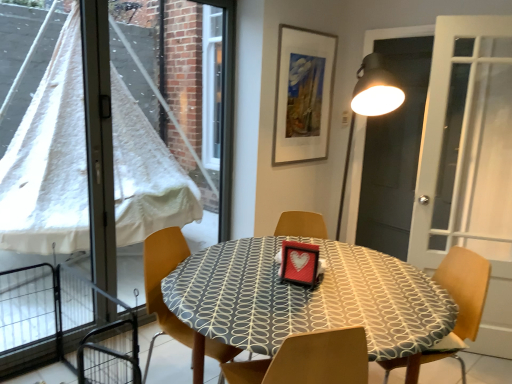
This screenshot has height=384, width=512. Describe the element at coordinates (303, 95) in the screenshot. I see `matte wooden picture frame at upper center` at that location.

The height and width of the screenshot is (384, 512). Identify the location of transparent plastic window at left. (49, 158).

Measure the distance between point (399, 53) and camera.

Point (399, 53) and camera are 8.89 feet apart from each other.

Describe the element at coordinates (66, 325) in the screenshot. I see `black metal gate at lower left` at that location.

Where is `matte wooden picture frame at upper center`? matte wooden picture frame at upper center is located at coordinates (303, 95).

Considering the relative sizes of matte wooden picture frame at upper center and patterned fabric table at center in the image provided, is matte wooden picture frame at upper center thinner than patterned fabric table at center?

Yes.

Measure the distance between matte wooden picture frame at upper center and patterned fabric table at center.

matte wooden picture frame at upper center and patterned fabric table at center are 1.22 meters apart.

Does matte wooden picture frame at upper center have a greater height compared to patterned fabric table at center?

Yes.

Is matte wooden picture frame at upper center with patterned fabric table at center?

No, matte wooden picture frame at upper center is not in contact with patterned fabric table at center.

In terms of width, does patterned fabric table at center look wider or thinner when compared to black matte screen door at upper right?

In the image, patterned fabric table at center appears to be wider than black matte screen door at upper right.

Which object is more forward, patterned fabric table at center or black matte screen door at upper right?

patterned fabric table at center is closer to the camera.

Does point (167, 316) come in front of point (397, 159)?

That is True.

Could you tell me if patterned fabric table at center is turned towards black matte screen door at upper right?

No.

Could wooden chair at right, arranged as the 2th chair when viewed from the left, be considered to be inside black metal gate at lower left?

Definitely not — wooden chair at right, arranged as the 2th chair when viewed from the left, is not inside black metal gate at lower left.

From a real-world perspective, between black metal gate at lower left and wooden chair at right, arranged as the 2th chair when viewed from the left, who is vertically lower?

black metal gate at lower left.

In the image, is black metal gate at lower left positioned in front of or behind wooden chair at right, positioned as the first chair in right-to-left order?

Visually, black metal gate at lower left is located in front of wooden chair at right, positioned as the first chair in right-to-left order.

This screenshot has width=512, height=384. Find the location of `chair that is the 2nd one when counting rightward from the black metal gate at lower left`. chair that is the 2nd one when counting rightward from the black metal gate at lower left is located at coordinates (461, 301).

Is matte wooden picture frame at upper center situated inside black matte screen door at upper right or outside?

matte wooden picture frame at upper center is outside black matte screen door at upper right.

Is matte wooden picture frame at upper center bigger than black matte screen door at upper right?

Correct, matte wooden picture frame at upper center is larger in size than black matte screen door at upper right.

Measure the distance from matte wooden picture frame at upper center to black matte screen door at upper right.

A distance of 23.12 inches exists between matte wooden picture frame at upper center and black matte screen door at upper right.

Between point (282, 106) and point (407, 167), which one is positioned behind?

The point (407, 167) is farther.

Does matte wooden picture frame at upper center touch transparent plastic window at left?

No, matte wooden picture frame at upper center is not next to transparent plastic window at left.

Looking at this image, which is closer, [311,60] or [58,60]?

Clearly, point [311,60] is closer to the camera than point [58,60].

Is matte wooden picture frame at upper center not within transparent plastic window at left?

Absolutely, matte wooden picture frame at upper center is external to transparent plastic window at left.

Is transparent plastic window at left taller than wooden chair at right, arranged as the 2th chair when viewed from the left?

Indeed, transparent plastic window at left has a greater height compared to wooden chair at right, arranged as the 2th chair when viewed from the left.

Is point (78, 368) closer to viewer compared to point (464, 277)?

No, it is not.

Locate an element on the screen. The width and height of the screenshot is (512, 384). window above the wooden chair at right, positioned as the first chair in right-to-left order (from the image's perspective) is located at coordinates (49, 158).

Is transparent plastic window at left located outside wooden chair at right, positioned as the first chair in right-to-left order?

Yes.

From a real-world perspective, is transparent plastic window at left positioned above or below wooden chair at center, arranged as the 1th chair when viewed from the left?

transparent plastic window at left is situated higher than wooden chair at center, arranged as the 1th chair when viewed from the left, in the real world.

Which object is more forward, transparent plastic window at left or wooden chair at center, placed as the second chair when sorted from right to left?

wooden chair at center, placed as the second chair when sorted from right to left, is in front.

Considering the points (196, 218) and (175, 249), which point is in front, point (196, 218) or point (175, 249)?

Positioned in front is point (175, 249).

This screenshot has width=512, height=384. Find the location of `table below the matte wooden picture frame at upper center (from the image's perspective)`. table below the matte wooden picture frame at upper center (from the image's perspective) is located at coordinates (162, 278).

The height and width of the screenshot is (384, 512). In the image, there is a patterned fabric table at center. What are the coordinates of `screen door above it (from the image's perspective)` in the screenshot? It's located at tap(394, 150).

Estimate the real-world distances between objects in this image. Which object is closer to matte wooden picture frame at upper center, wooden chair at center, arranged as the 1th chair when viewed from the left, or black metal gate at lower left?

wooden chair at center, arranged as the 1th chair when viewed from the left, is closer to matte wooden picture frame at upper center.

Based on their spatial positions, is wooden chair at center, placed as the second chair when sorted from right to left, or black metal gate at lower left closer to wooden chair at right, arranged as the 2th chair when viewed from the left?

Among the two, wooden chair at center, placed as the second chair when sorted from right to left, is located nearer to wooden chair at right, arranged as the 2th chair when viewed from the left.

Based on their spatial positions, is wooden chair at center, placed as the second chair when sorted from right to left, or wooden chair at right, arranged as the 2th chair when viewed from the left, further from transparent plastic window at left?

wooden chair at right, arranged as the 2th chair when viewed from the left, lies further to transparent plastic window at left than the other object.

Based on their spatial positions, is patterned fabric table at center or wooden chair at center, arranged as the 1th chair when viewed from the left, further from wooden chair at right, positioned as the first chair in right-to-left order?

The object further to wooden chair at right, positioned as the first chair in right-to-left order, is wooden chair at center, arranged as the 1th chair when viewed from the left.

Considering their positions, is transparent plastic window at left positioned closer to black metal gate at lower left than wooden chair at center, placed as the second chair when sorted from right to left?

transparent plastic window at left lies closer to black metal gate at lower left than the other object.

When comparing their distances from black matte screen door at upper right, does patterned fabric table at center or black metal gate at lower left seem closer?

patterned fabric table at center.

From the image, which object appears to be nearer to matte wooden picture frame at upper center, wooden chair at center, arranged as the 1th chair when viewed from the left, or black matte screen door at upper right?

Among the two, black matte screen door at upper right is located nearer to matte wooden picture frame at upper center.

Based on their spatial positions, is wooden chair at right, positioned as the first chair in right-to-left order, or patterned fabric table at center closer to transparent plastic window at left?

The object closer to transparent plastic window at left is patterned fabric table at center.

Find the location of a particular element. screen door between matte wooden picture frame at upper center and wooden chair at right, arranged as the 2th chair when viewed from the left, vertically is located at coordinates (394, 150).

I want to click on screen door positioned between wooden chair at center, placed as the second chair when sorted from right to left, and matte wooden picture frame at upper center from near to far, so tap(394, 150).

Where is `picture frame located between transparent plastic window at left and black matte screen door at upper right in the left-right direction`? The height and width of the screenshot is (384, 512). picture frame located between transparent plastic window at left and black matte screen door at upper right in the left-right direction is located at coordinates pyautogui.click(x=303, y=95).

Where is `table situated between transparent plastic window at left and black matte screen door at upper right from left to right`? Image resolution: width=512 pixels, height=384 pixels. table situated between transparent plastic window at left and black matte screen door at upper right from left to right is located at coordinates (162, 278).